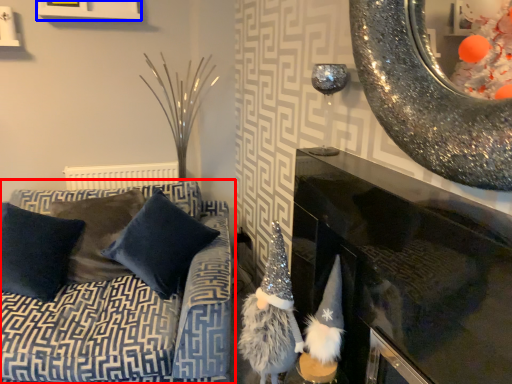
Question: Which of the following is the closest to the observer, studio couch (highlighted by a red box) or picture frame (highlighted by a blue box)?

Choices:
 (A) studio couch
 (B) picture frame

Answer: (A)